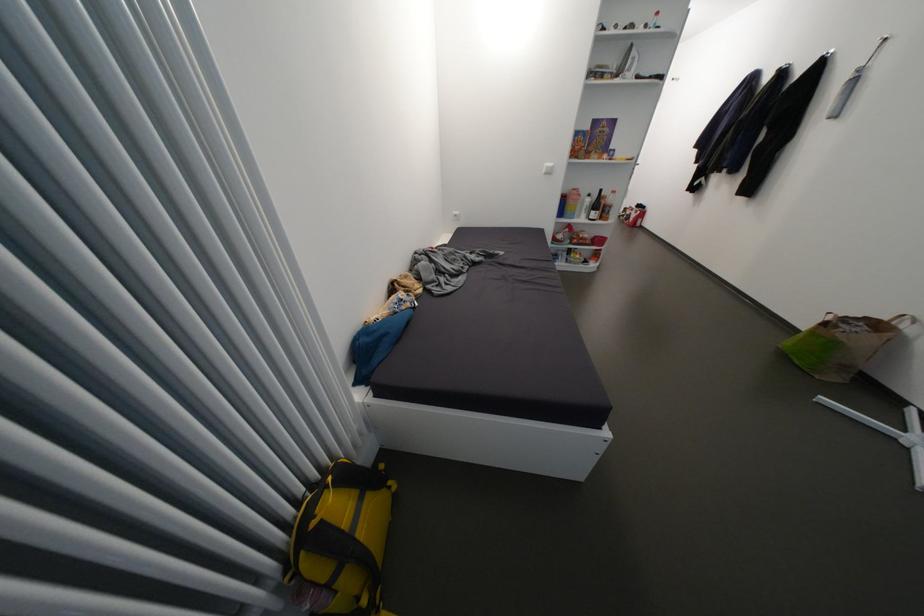
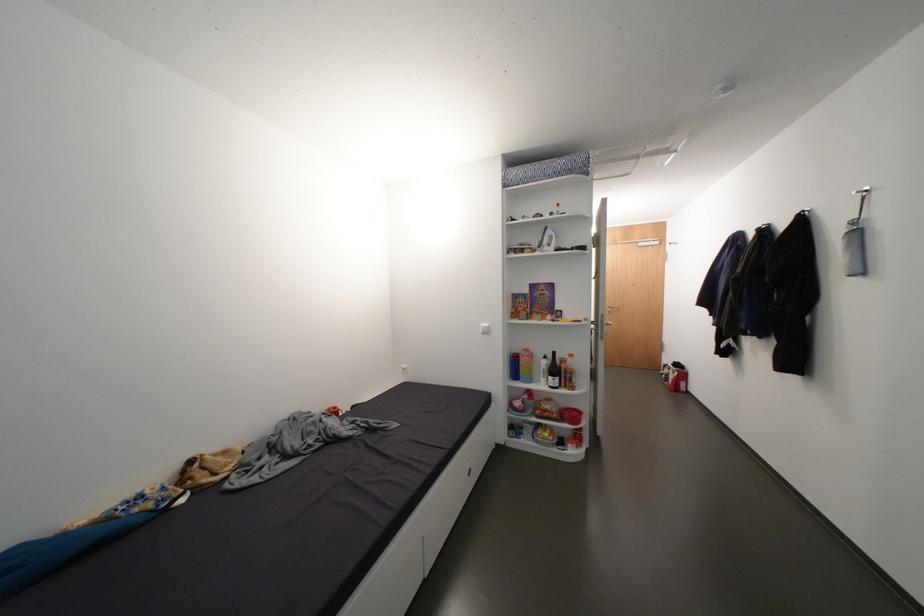
In the second image, find the point that corresponds to pixel 647 214 in the first image.

(684, 374)